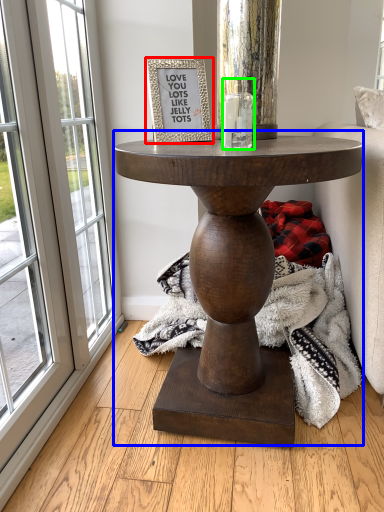
Question: Considering the real-world distances, which object is farthest from picture frame (highlighted by a red box)? table (highlighted by a blue box) or candle holder (highlighted by a green box)?

Choices:
 (A) table
 (B) candle holder

Answer: (A)